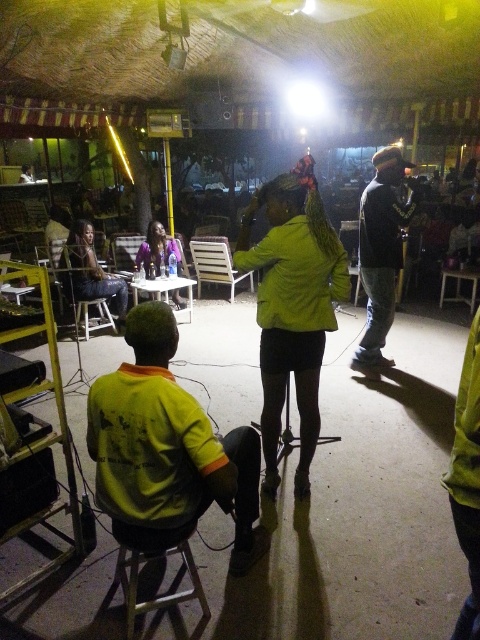
Question: Considering the real-world distances, which object is closest to the matte black jacket at left?

Choices:
 (A) yellow fabric shirt at lower left
 (B) matte green jacket at center
 (C) wooden slats chair at center
 (D) metallic stool at lower left

Answer: (C)

Question: Can you confirm if metallic stool at lower left is positioned to the right of wooden slats chair at center?

Choices:
 (A) no
 (B) yes

Answer: (B)

Question: Estimate the real-world distances between objects in this image. Which object is closer to the black matte sweater at center?

Choices:
 (A) wooden slats chair at center
 (B) matte black jacket at left
 (C) matte purple jacket at center
 (D) metallic stool at lower left

Answer: (C)

Question: Does black matte sweater at center have a lesser width compared to matte black jacket at left?

Choices:
 (A) no
 (B) yes

Answer: (B)

Question: Can you confirm if black matte sweater at center is bigger than wooden slats chair at center?

Choices:
 (A) yes
 (B) no

Answer: (B)

Question: Which point is farther to the camera?

Choices:
 (A) matte purple jacket at center
 (B) yellow fabric shirt at lower left
 (C) wooden slats chair at center

Answer: (C)